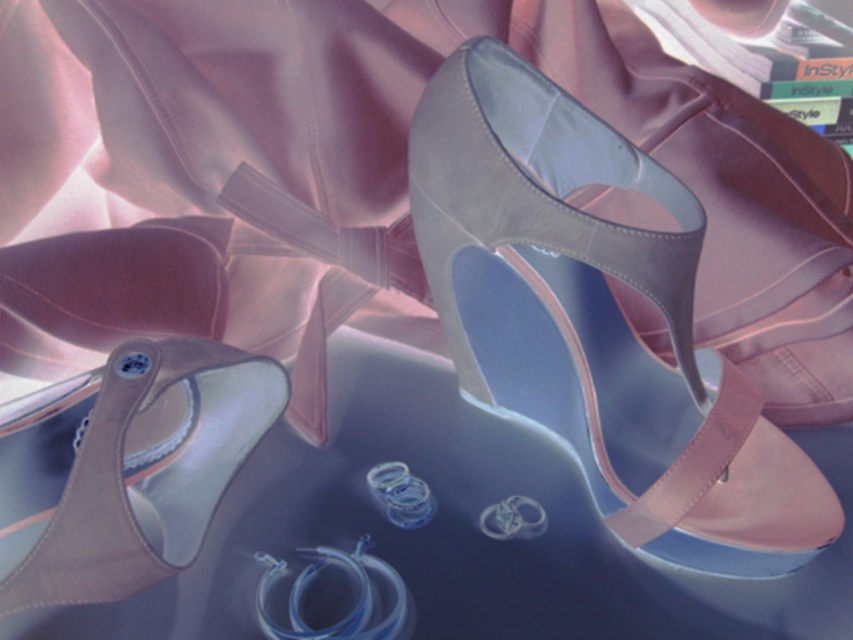
Does satin beige high-heeled sandal at center have a larger size compared to satin beige sandal at lower left?

Yes, satin beige high-heeled sandal at center is bigger than satin beige sandal at lower left.

Who is more forward, (x=810, y=509) or (x=141, y=516)?

Positioned in front is point (x=810, y=509).

Is point (666, 374) farther from viewer compared to point (129, 572)?

Yes.

Where is `satin beige high-heeled sandal at center`? satin beige high-heeled sandal at center is located at coordinates (596, 321).